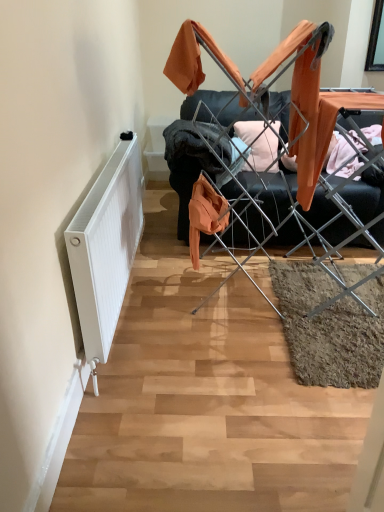
In order to face metal drying rack at center, should I rotate leftwards or rightwards?

Answer: To align with it, rotate right about 11.736°.

What is the approximate width of metal drying rack at center?

metal drying rack at center is 74.52 centimeters wide.

This screenshot has height=512, width=384. Identify the location of white matte radiator at left. (106, 248).

Considering the relative sizes of white matte radiator at left and orange fabric at center in the image provided, is white matte radiator at left shorter than orange fabric at center?

In fact, white matte radiator at left may be taller than orange fabric at center.

Is white matte radiator at left looking in the opposite direction of orange fabric at center?

white matte radiator at left is not turned away from orange fabric at center.

Is point (105, 316) closer to camera compared to point (185, 123)?

That is True.

Considering the relative sizes of white matte radiator at left and orange fabric at center in the image provided, is white matte radiator at left thinner than orange fabric at center?

Yes, white matte radiator at left is thinner than orange fabric at center.

Is point (294, 106) in front of point (102, 190)?

No, it is behind (102, 190).

Is metal drying rack at center directly adjacent to white matte radiator at left?

metal drying rack at center and white matte radiator at left are not in contact.

From the image's perspective, which one is positioned higher, metal drying rack at center or white matte radiator at left?

metal drying rack at center, from the image's perspective.

Is metal drying rack at center oriented away from white matte radiator at left?

No, metal drying rack at center is not facing the opposite direction of white matte radiator at left.

Based on the photo, from the image's perspective, which is above, white matte radiator at left or metal drying rack at center?

metal drying rack at center is shown above in the image.

The height and width of the screenshot is (512, 384). What are the coordinates of `furniture above the white matte radiator at left (from a real-world perspective)` in the screenshot? It's located at (291, 91).

Between white matte radiator at left and metal drying rack at center, which one has more height?

metal drying rack at center.

How many degrees apart are the facing directions of white matte radiator at left and metal drying rack at center?

white matte radiator at left and metal drying rack at center are facing 92.3 degrees away from each other.

Is orange fabric at center not close to white matte radiator at left?

orange fabric at center is near white matte radiator at left, not far away.

Who is shorter, orange fabric at center or white matte radiator at left?

orange fabric at center.

From the image's perspective, which is above, orange fabric at center or white matte radiator at left?

orange fabric at center.

From the image's perspective, between metal drying rack at center and orange fabric at center, who is located below?

metal drying rack at center.

Identify the location of clothing that appears behind the metal drying rack at center. This screenshot has height=512, width=384. (201, 151).

Between metal drying rack at center and orange fabric at center, which one has more height?

Standing taller between the two is metal drying rack at center.

In the scene shown: From a real-world perspective, is orange fabric at center under metal drying rack at center?

Yes.

Can you see orange fabric at center touching metal drying rack at center?

There is a gap between orange fabric at center and metal drying rack at center.

Can we say orange fabric at center lies outside metal drying rack at center?

Yes, orange fabric at center is outside of metal drying rack at center.

Considering the relative positions of orange fabric at center and metal drying rack at center in the image provided, is orange fabric at center to the right of metal drying rack at center from the viewer's perspective?

No, orange fabric at center is not to the right of metal drying rack at center.

You are a GUI agent. You are given a task and a screenshot of the screen. Output one action in this format:
    pyautogui.click(x=<x>, y=<y>)
    Task: Click on the clothing on the right of white matte radiator at left
    
    Given the screenshot: What is the action you would take?
    pyautogui.click(x=201, y=151)

Locate an element on the screen. Image resolution: width=384 pixels, height=512 pixels. radiator located on the left of metal drying rack at center is located at coordinates (106, 248).

When comparing their distances from white matte radiator at left, does metal drying rack at center or orange fabric at center seem closer?

The object closer to white matte radiator at left is orange fabric at center.

In the scene shown: Based on their spatial positions, is white matte radiator at left or orange fabric at center closer to metal drying rack at center?

Among the two, orange fabric at center is located nearer to metal drying rack at center.

Looking at the image, which one is located closer to orange fabric at center, metal drying rack at center or white matte radiator at left?

The object closer to orange fabric at center is white matte radiator at left.

From the image, which object appears to be nearer to metal drying rack at center, orange fabric at center or white matte radiator at left?

Based on the image, orange fabric at center appears to be nearer to metal drying rack at center.

From the image, which object appears to be farther from white matte radiator at left, orange fabric at center or metal drying rack at center?

Based on the image, metal drying rack at center appears to be further to white matte radiator at left.

From the image, which object appears to be nearer to orange fabric at center, white matte radiator at left or metal drying rack at center?

Based on the image, white matte radiator at left appears to be nearer to orange fabric at center.

Locate an element on the screen. furniture between white matte radiator at left and orange fabric at center along the z-axis is located at coordinates (291, 91).